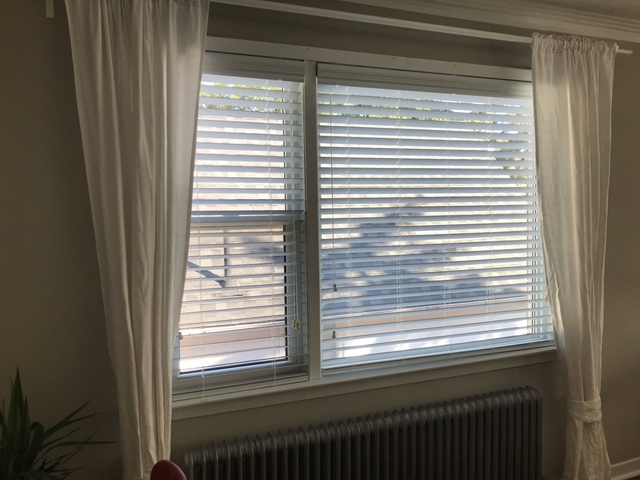
Where is `house plant leaves`? house plant leaves is located at coordinates (20, 435).